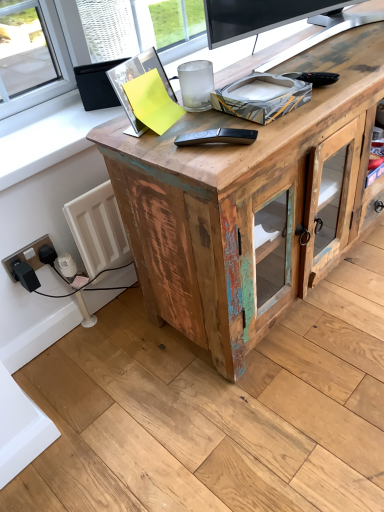
Locate an element on the screen. The height and width of the screenshot is (512, 384). free space behind black plastic remote control at center is located at coordinates (205, 122).